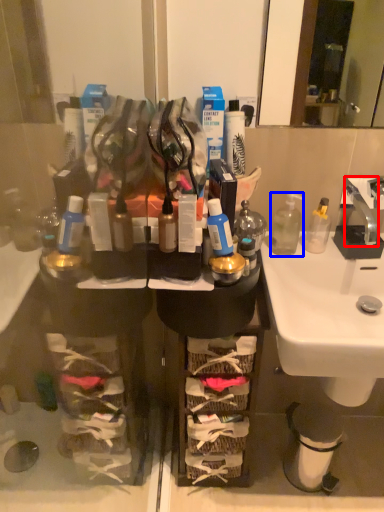
Question: Which object is closer to the camera taking this photo, faucet (highlighted by a red box) or bottle (highlighted by a blue box)?

Choices:
 (A) faucet
 (B) bottle

Answer: (A)